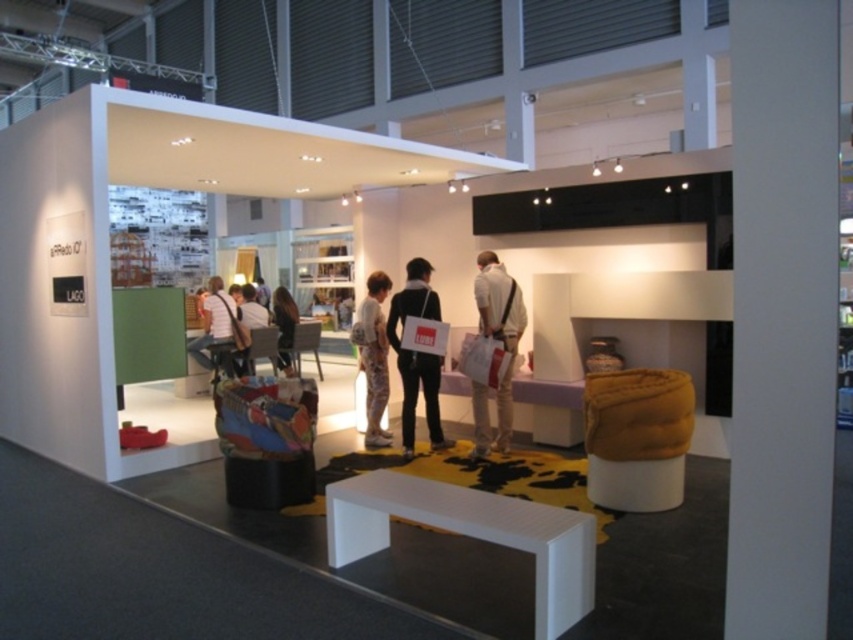
You are a visitor at the exhibition and want to touch both the white textured dress at center and the white fabric chair at center. If you are standing at the entrance, which object will you reach first?

The white textured dress at center and the white fabric chair at center are both at the center, so you will reach them at the same time.

You are at the entrance of the exhibition space and see two points marked on the floor. The first point is labeled as point (383, 280) and the second is point (231, 296). If you want to walk towards the back wall, which point should you aim for?

Point (383, 280) is in front of point (231, 296), so to walk towards the back wall, you should aim for point (231, 296) since it is closer to the back wall.

You are standing in the exhibition space and want to reach a specific point marked at coordinates point (357, 342). If your current position is 5 meters away from the camera, can you walk directly to this point without any obstacles?

The distance of point (357, 342) from camera is 6.10 meters. Since you are currently 5 meters away from the camera, you need to walk an additional 1.1 meters to reach the point. However, the description does not mention any obstacles between your current position and the point, so assuming the path is clear, you can proceed directly.